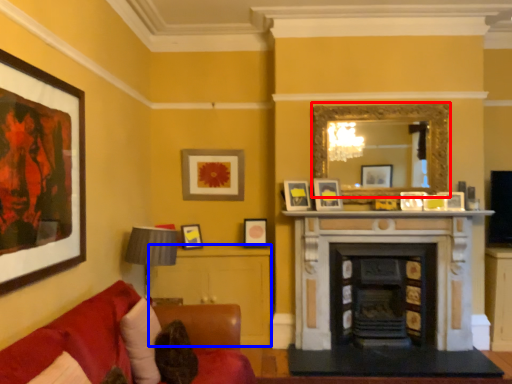
Question: Which of the following is the closest to the observer, mirror (highlighted by a red box) or table (highlighted by a blue box)?

Choices:
 (A) mirror
 (B) table

Answer: (A)